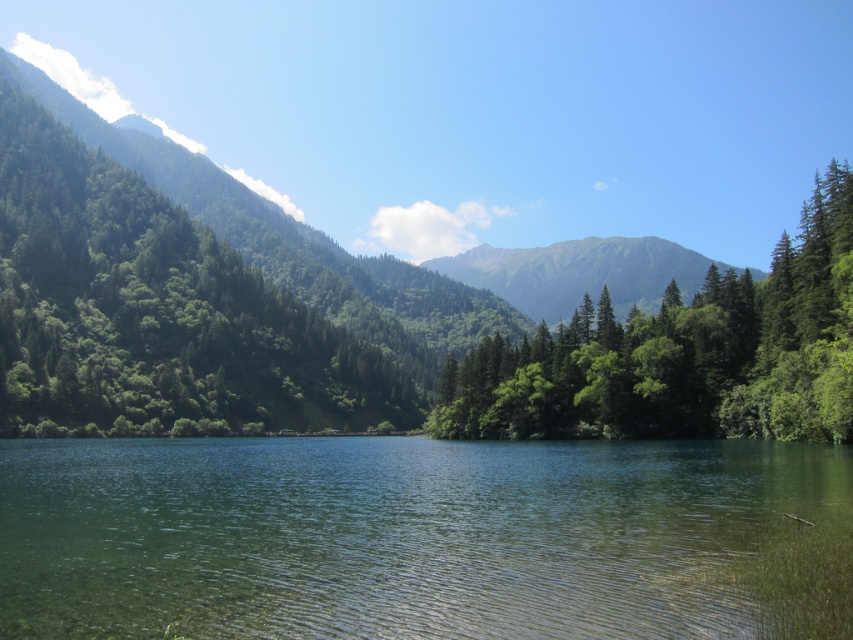
Question: Which object appears farthest from the camera in this image?

Choices:
 (A) green grassy mountain at center
 (B) green matte tree at center

Answer: (A)

Question: Does clear water at center have a lesser width compared to green grassy mountain at center?

Choices:
 (A) no
 (B) yes

Answer: (B)

Question: Among these points, which one is nearest to the camera?

Choices:
 (A) (463, 435)
 (B) (548, 278)

Answer: (A)

Question: Based on their relative distances, which object is nearer to the green matte tree at center?

Choices:
 (A) green grassy mountain at center
 (B) green leafy trees at left
 (C) clear water at center

Answer: (C)

Question: Is green matte tree at center to the right of green grassy mountain at center from the viewer's perspective?

Choices:
 (A) no
 (B) yes

Answer: (A)

Question: Can you confirm if green leafy trees at left is bigger than green grassy mountain at center?

Choices:
 (A) no
 (B) yes

Answer: (A)